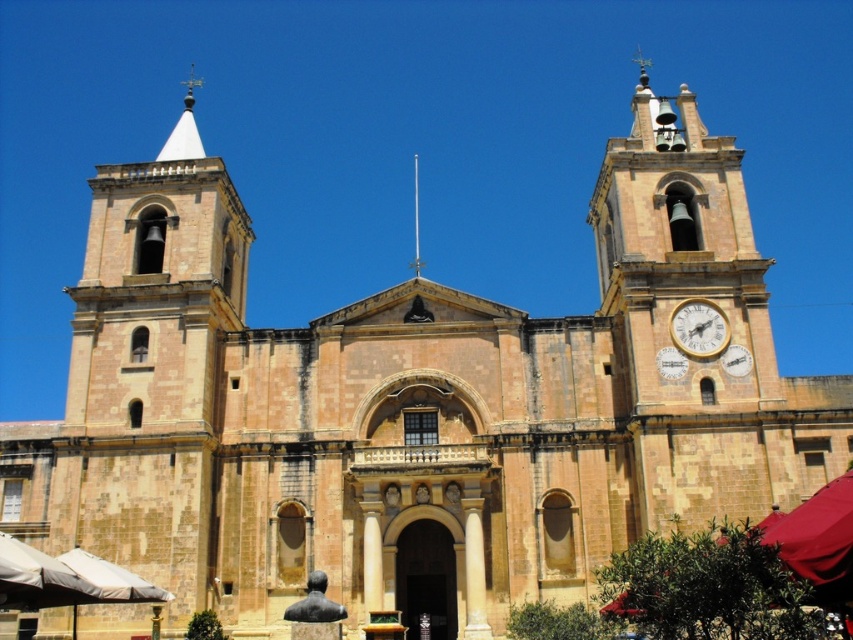
Question: Does gold metallic clock at right have a larger size compared to metallic spire at center?

Choices:
 (A) no
 (B) yes

Answer: (A)

Question: Is gold metallic clock at right below metallic spire at center?

Choices:
 (A) yes
 (B) no

Answer: (A)

Question: Which point is farther to the camera?

Choices:
 (A) gold metallic clock at right
 (B) metallic spire at center

Answer: (B)

Question: Which point is farther from the camera taking this photo?

Choices:
 (A) (709, 349)
 (B) (416, 259)

Answer: (B)

Question: Does gold metallic clock at right appear under metallic spire at center?

Choices:
 (A) yes
 (B) no

Answer: (A)

Question: Among these objects, which one is farthest from the camera?

Choices:
 (A) metallic spire at center
 (B) gold metallic clock at right

Answer: (A)